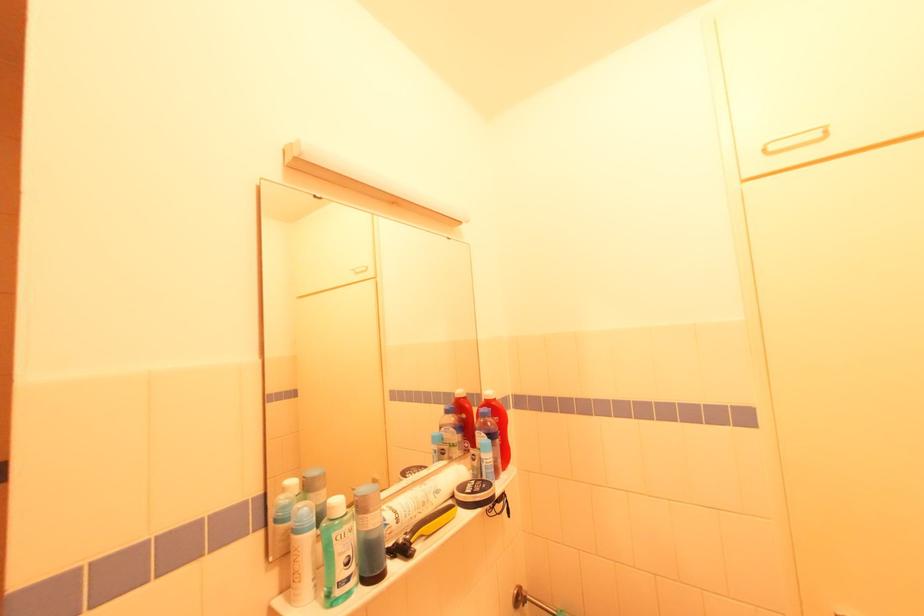
The height and width of the screenshot is (616, 924). Describe the element at coordinates (412, 541) in the screenshot. I see `a pump dispenser head` at that location.